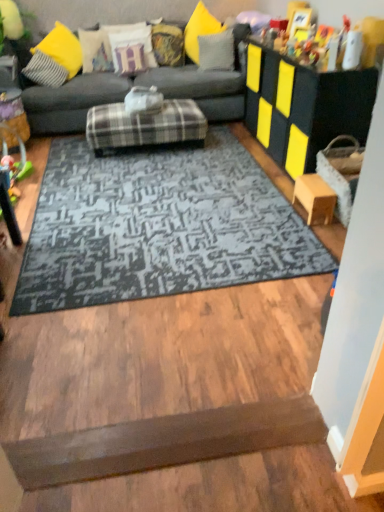
What do you see at coordinates (129, 59) in the screenshot?
I see `velvet white pillow at upper center, the 4th pillow from the right` at bounding box center [129, 59].

What do you see at coordinates (158, 226) in the screenshot? I see `dark gray textured rug at center` at bounding box center [158, 226].

This screenshot has width=384, height=512. Describe the element at coordinates (13, 187) in the screenshot. I see `plastic green toy at left` at that location.

What are the coordinates of `velvet white pillow at upper center, the third pillow when ordered from left to right` in the screenshot? It's located at [129, 59].

From the picture: Is yellow fabric pillow at upper center, the fifth pillow when ordered from left to right, placed right next to dark gray textured rug at center?

yellow fabric pillow at upper center, the fifth pillow when ordered from left to right, and dark gray textured rug at center are not in contact.

Is yellow fabric pillow at upper center, which ranks as the second pillow in right-to-left order, not within dark gray textured rug at center?

Yes, yellow fabric pillow at upper center, which ranks as the second pillow in right-to-left order, is outside of dark gray textured rug at center.

Does point (185, 44) appear closer or farther from the camera than point (232, 213)?

Point (185, 44).

How many degrees apart are the facing directions of yellow fabric pillow at upper center, which ranks as the second pillow in right-to-left order, and dark gray textured rug at center?

The facing directions of yellow fabric pillow at upper center, which ranks as the second pillow in right-to-left order, and dark gray textured rug at center are 55.9 degrees apart.

Can you confirm if dark gray textured rug at center is wider than textured cream pillow at upper left, marked as the first pillow in a left-to-right arrangement?

Correct, the width of dark gray textured rug at center exceeds that of textured cream pillow at upper left, marked as the first pillow in a left-to-right arrangement.

From the image's perspective, is dark gray textured rug at center over textured cream pillow at upper left, placed as the 6th pillow when sorted from right to left?

Incorrect, from the image's perspective, dark gray textured rug at center is lower than textured cream pillow at upper left, placed as the 6th pillow when sorted from right to left.

Is textured cream pillow at upper left, marked as the first pillow in a left-to-right arrangement, located within dark gray textured rug at center?

Actually, textured cream pillow at upper left, marked as the first pillow in a left-to-right arrangement, is outside dark gray textured rug at center.

Is plaid fabric ottoman at center further to the viewer compared to yellow fabric pillow at upper center, the fifth pillow when ordered from left to right?

No, plaid fabric ottoman at center is closer to the camera.

Could you tell me if plaid fabric ottoman at center is turned towards yellow fabric pillow at upper center, which ranks as the second pillow in right-to-left order?

No, plaid fabric ottoman at center is not oriented towards yellow fabric pillow at upper center, which ranks as the second pillow in right-to-left order.

From a real-world perspective, is plaid fabric ottoman at center on top of yellow fabric pillow at upper center, which ranks as the second pillow in right-to-left order?

No, from a real-world perspective, plaid fabric ottoman at center is not on top of yellow fabric pillow at upper center, which ranks as the second pillow in right-to-left order.

Is point (144, 133) closer to viewer compared to point (187, 33)?

Yes, point (144, 133) is in front of point (187, 33).

Is plaid fabric ottoman at center taller or shorter than black foam cube at upper right, arranged as the 2th table when ordered from the bottom?

In the image, plaid fabric ottoman at center appears to be shorter than black foam cube at upper right, arranged as the 2th table when ordered from the bottom.

Considering the relative sizes of plaid fabric ottoman at center and black foam cube at upper right, arranged as the 2th table when ordered from the bottom, in the image provided, is plaid fabric ottoman at center smaller than black foam cube at upper right, arranged as the 2th table when ordered from the bottom,?

Correct, plaid fabric ottoman at center occupies less space than black foam cube at upper right, arranged as the 2th table when ordered from the bottom.

In terms of width, does plaid fabric ottoman at center look wider or thinner when compared to black foam cube at upper right, arranged as the 2th table when ordered from the bottom?

In the image, plaid fabric ottoman at center appears to be wider than black foam cube at upper right, arranged as the 2th table when ordered from the bottom.

Could you tell me if plaid fabric ottoman at center is turned towards black foam cube at upper right, arranged as the 2th table when ordered from the bottom?

No.

How far apart are gray fabric couch at upper center and dark gray textured rug at center?

The distance of gray fabric couch at upper center from dark gray textured rug at center is 2.59 meters.

Which of these two, gray fabric couch at upper center or dark gray textured rug at center, stands shorter?

dark gray textured rug at center.

Considering the positions of objects gray fabric couch at upper center and dark gray textured rug at center in the image provided, who is in front, gray fabric couch at upper center or dark gray textured rug at center?

dark gray textured rug at center is in front.

Is gray fabric couch at upper center in contact with dark gray textured rug at center?

No, gray fabric couch at upper center is not in contact with dark gray textured rug at center.

The height and width of the screenshot is (512, 384). Find the location of `pillow behind the velvet yellow pillow at upper center, the fifth pillow positioned from the right`. pillow behind the velvet yellow pillow at upper center, the fifth pillow positioned from the right is located at coordinates (168, 42).

From a real-world perspective, is velvet yellow pillow at upper center, placed as the 2th pillow when sorted from left to right, above or below textured fabric pillow at upper center, the 3th pillow in the right-to-left sequence?

In terms of real-world spatial position, velvet yellow pillow at upper center, placed as the 2th pillow when sorted from left to right, is below textured fabric pillow at upper center, the 3th pillow in the right-to-left sequence.

Does velvet yellow pillow at upper center, the fifth pillow positioned from the right, turn towards textured fabric pillow at upper center, positioned as the fourth pillow in left-to-right order?

No, velvet yellow pillow at upper center, the fifth pillow positioned from the right, is not turned towards textured fabric pillow at upper center, positioned as the fourth pillow in left-to-right order.

How far apart are velvet yellow pillow at upper center, the fifth pillow positioned from the right, and textured fabric pillow at upper center, positioned as the fourth pillow in left-to-right order?

A distance of 7.78 inches exists between velvet yellow pillow at upper center, the fifth pillow positioned from the right, and textured fabric pillow at upper center, positioned as the fourth pillow in left-to-right order.

Can you confirm if gray fabric pillow at upper center, which appears as the 1th pillow when viewed from the right, is positioned to the left of black foam cube at upper right, the 1th table viewed from the top?

Correct, you'll find gray fabric pillow at upper center, which appears as the 1th pillow when viewed from the right, to the left of black foam cube at upper right, the 1th table viewed from the top.

How much distance is there between gray fabric pillow at upper center, which appears as the 1th pillow when viewed from the right, and black foam cube at upper right, the 1th table viewed from the top?

They are 3.31 feet apart.

Is gray fabric pillow at upper center, which appears as the 1th pillow when viewed from the right, looking in the opposite direction of black foam cube at upper right, arranged as the 2th table when ordered from the bottom?

No, gray fabric pillow at upper center, which appears as the 1th pillow when viewed from the right,'s orientation is not away from black foam cube at upper right, arranged as the 2th table when ordered from the bottom.

Considering the sizes of objects gray fabric pillow at upper center, which appears as the 1th pillow when viewed from the right, and black foam cube at upper right, the 1th table viewed from the top, in the image provided, who is thinner, gray fabric pillow at upper center, which appears as the 1th pillow when viewed from the right, or black foam cube at upper right, the 1th table viewed from the top,?

gray fabric pillow at upper center, which appears as the 1th pillow when viewed from the right.

Locate an element on the screen. mat located in front of the yellow fabric pillow at upper center, which ranks as the second pillow in right-to-left order is located at coordinates (158, 226).

What are the coordinates of `the 5th pillow positioned above the dark gray textured rug at center (from a real-world perspective)` in the screenshot? It's located at (95, 51).

When comparing their distances from dark gray textured rug at center, does textured fabric pillow at upper center, positioned as the fourth pillow in left-to-right order, or black foam cube at upper right, the 1th table viewed from the top, seem further?

textured fabric pillow at upper center, positioned as the fourth pillow in left-to-right order.

Looking at the image, which one is located closer to wooden stool at lower right, dark gray textured rug at center or black foam cube at upper right, arranged as the 2th table when ordered from the bottom?

Based on the image, black foam cube at upper right, arranged as the 2th table when ordered from the bottom, appears to be nearer to wooden stool at lower right.

From the image, which object appears to be farther from dark gray textured rug at center, velvet yellow pillow at upper center, placed as the 2th pillow when sorted from left to right, or plastic green toy at left?

Based on the image, velvet yellow pillow at upper center, placed as the 2th pillow when sorted from left to right, appears to be further to dark gray textured rug at center.

Based on their spatial positions, is plaid fabric ottoman at center or dark gray textured rug at center closer to gray fabric pillow at upper center, which appears as the 1th pillow when viewed from the right?

plaid fabric ottoman at center is positioned closer to the anchor gray fabric pillow at upper center, which appears as the 1th pillow when viewed from the right.

Which object lies nearer to the anchor point textured fabric pillow at upper center, positioned as the fourth pillow in left-to-right order, yellow fabric pillow at upper center, which ranks as the second pillow in right-to-left order, or black foam cube at upper right, arranged as the 2th table when ordered from the bottom?

yellow fabric pillow at upper center, which ranks as the second pillow in right-to-left order.

Considering their positions, is yellow fabric pillow at upper center, which ranks as the second pillow in right-to-left order, positioned further to velvet white pillow at upper center, the 4th pillow from the right, than plaid fabric ottoman at center?

plaid fabric ottoman at center is further to velvet white pillow at upper center, the 4th pillow from the right.

Based on their spatial positions, is black foam cube at upper right, arranged as the 2th table when ordered from the bottom, or wooden stool at lower right further from velvet yellow pillow at upper center, the fifth pillow positioned from the right?

wooden stool at lower right lies further to velvet yellow pillow at upper center, the fifth pillow positioned from the right, than the other object.

Looking at the image, which one is located closer to plaid fabric ottoman at center, velvet yellow pillow at upper center, the fifth pillow positioned from the right, or gray fabric couch at upper center?

Among the two, velvet yellow pillow at upper center, the fifth pillow positioned from the right, is located nearer to plaid fabric ottoman at center.

This screenshot has width=384, height=512. I want to click on the footrest situated between plastic green toy at left and gray fabric pillow at upper center, positioned as the 6th pillow in left-to-right order, from left to right, so click(144, 126).

Where is `pillow between dark gray textured rug at center and gray fabric pillow at upper center, positioned as the 6th pillow in left-to-right order, along the z-axis`? The width and height of the screenshot is (384, 512). pillow between dark gray textured rug at center and gray fabric pillow at upper center, positioned as the 6th pillow in left-to-right order, along the z-axis is located at coordinates point(199,30).

This screenshot has height=512, width=384. What are the coordinates of `studio couch between plastic green toy at left and black foam cube at upper right, the 1th table viewed from the top, from left to right` in the screenshot? It's located at (71, 102).

I want to click on footrest between gray fabric couch at upper center and wooden table at right, placed as the 1th table when sorted from bottom to top, so click(x=144, y=126).